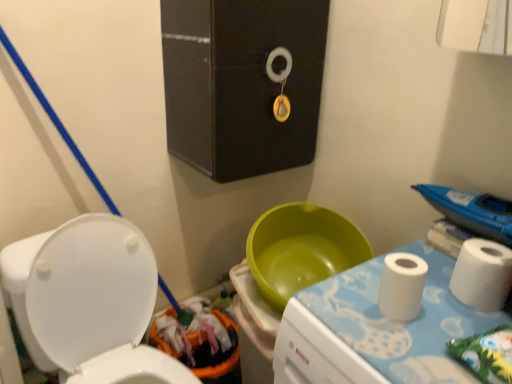
Identify the location of orange fabric potty at lower left. The height and width of the screenshot is (384, 512). (200, 342).

What is the approximate height of white matte toilet paper at right?

white matte toilet paper at right is 10.34 centimeters tall.

Describe the element at coordinates (472, 211) in the screenshot. I see `white paper towel at right` at that location.

I want to click on orange fabric potty at lower left, so click(x=200, y=342).

Which is less distant, (494, 287) or (493, 225)?

Point (494, 287) appears to be closer to the viewer than point (493, 225).

Is white matte toilet paper at right wider than white paper towel at right?

No, white matte toilet paper at right is not wider than white paper towel at right.

From a real-world perspective, which is physically below, white matte toilet paper at right or white paper towel at right?

white matte toilet paper at right.

In the image, is white matte toilet paper at right positioned in front of or behind white paper towel at right?

white matte toilet paper at right is in front of white paper towel at right.

Is white paper towel at right in front of or behind white matte toilet paper at right in the image?

Visually, white paper towel at right is located behind white matte toilet paper at right.

Identify the location of toilet paper beneath the white paper towel at right (from a real-world perspective). (402, 286).

Between white paper towel at right and white matte toilet paper at right, which one has smaller width?

With smaller width is white matte toilet paper at right.

Does point (461, 200) lie in front of point (420, 281)?

No, (461, 200) is further to viewer.

Considering the relative sizes of white glossy toilet at lower left and white matte toilet paper at right in the image provided, is white glossy toilet at lower left smaller than white matte toilet paper at right?

Actually, white glossy toilet at lower left might be larger than white matte toilet paper at right.

Image resolution: width=512 pixels, height=384 pixels. I want to click on toiletry on the right of white glossy toilet at lower left, so click(x=482, y=275).

In terms of width, does white glossy toilet at lower left look wider or thinner when compared to white matte toilet paper at right?

white glossy toilet at lower left is wider than white matte toilet paper at right.

Is white glossy toilet at lower left turned away from orange fabric potty at lower left?

No, orange fabric potty at lower left is not at the back of white glossy toilet at lower left.

From a real-world perspective, is white glossy toilet at lower left over orange fabric potty at lower left?

Correct, in the physical world, white glossy toilet at lower left is higher than orange fabric potty at lower left.

Is white glossy toilet at lower left positioned behind orange fabric potty at lower left?

No, it is in front of orange fabric potty at lower left.

Is white glossy toilet at lower left thinner than orange fabric potty at lower left?

No, white glossy toilet at lower left is not thinner than orange fabric potty at lower left.

In terms of size, does white matte toilet paper at right appear bigger or smaller than orange fabric potty at lower left?

Considering their sizes, white matte toilet paper at right takes up less space than orange fabric potty at lower left.

From a real-world perspective, who is located lower, white matte toilet paper at right or orange fabric potty at lower left?

orange fabric potty at lower left, from a real-world perspective.

Between white matte toilet paper at right and orange fabric potty at lower left, which one appears on the right side from the viewer's perspective?

white matte toilet paper at right.

Is orange fabric potty at lower left inside white matte toilet paper at right?

Actually, orange fabric potty at lower left is outside white matte toilet paper at right.

Could you tell me if white fabric changing table at right is turned towards white glossy toilet at lower left?

No, white fabric changing table at right is not facing towards white glossy toilet at lower left.

Who is shorter, white fabric changing table at right or white glossy toilet at lower left?

Standing shorter between the two is white fabric changing table at right.

From a real-world perspective, which is physically below, white fabric changing table at right or white glossy toilet at lower left?

In real-world perspective, white glossy toilet at lower left is lower.

Find the location of a particular element. toilet located underneath the white fabric changing table at right (from a real-world perspective) is located at coordinates (92, 300).

From the image's perspective, is white fabric changing table at right above or below orange fabric potty at lower left?

Clearly, from the image's perspective, white fabric changing table at right is above orange fabric potty at lower left.

Would you consider white fabric changing table at right to be distant from orange fabric potty at lower left?

No, white fabric changing table at right is in close proximity to orange fabric potty at lower left.

Is white fabric changing table at right wider or thinner than orange fabric potty at lower left?

Considering their sizes, white fabric changing table at right looks broader than orange fabric potty at lower left.

Looking at this image, do you think white fabric changing table at right is within orange fabric potty at lower left, or outside of it?

white fabric changing table at right is located beyond the bounds of orange fabric potty at lower left.

You are a GUI agent. You are given a task and a screenshot of the screen. Output one action in this format:
    pyautogui.click(x=<x>, y=<y>)
    Task: Click on the appliance on the right of white matte toilet paper at right
    The width and height of the screenshot is (512, 384).
    Given the screenshot: What is the action you would take?
    pyautogui.click(x=472, y=211)

The height and width of the screenshot is (384, 512). I want to click on toilet paper lying on the left of white paper towel at right, so click(402, 286).

From the image, which object appears to be farther from orange fabric potty at lower left, white matte toilet paper at right or white fabric changing table at right?

white matte toilet paper at right is positioned further to the anchor orange fabric potty at lower left.

Considering their positions, is white matte toilet paper at right positioned closer to white glossy toilet at lower left than white matte toilet paper at right?

white matte toilet paper at right is closer to white glossy toilet at lower left.

From the image, which object appears to be farther from white matte toilet paper at right, white matte toilet paper at right or white fabric changing table at right?

The object further to white matte toilet paper at right is white matte toilet paper at right.

Looking at the image, which one is located further to black matte medicine cabinet at upper center, orange fabric potty at lower left or white fabric changing table at right?

The object further to black matte medicine cabinet at upper center is orange fabric potty at lower left.

Which object lies nearer to the anchor point white matte toilet paper at right, white matte toilet paper at right or orange fabric potty at lower left?

white matte toilet paper at right lies closer to white matte toilet paper at right than the other object.

Based on their spatial positions, is white matte toilet paper at right or white fabric changing table at right closer to orange fabric potty at lower left?

Based on the image, white fabric changing table at right appears to be nearer to orange fabric potty at lower left.

From the image, which object appears to be nearer to orange fabric potty at lower left, white matte toilet paper at right or white paper towel at right?

The object closer to orange fabric potty at lower left is white matte toilet paper at right.

When comparing their distances from white matte toilet paper at right, does white paper towel at right or white glossy toilet at lower left seem closer?

The object closer to white matte toilet paper at right is white paper towel at right.

This screenshot has height=384, width=512. I want to click on potty between white glossy toilet at lower left and white matte toilet paper at right in the horizontal direction, so click(x=200, y=342).

I want to click on toilet between white fabric changing table at right and orange fabric potty at lower left from front to back, so click(92, 300).

Identify the location of toilet paper between white paper towel at right and white fabric changing table at right vertically. (402, 286).

Where is `toilet paper situated between white glossy toilet at lower left and white matte toilet paper at right from left to right`? Image resolution: width=512 pixels, height=384 pixels. toilet paper situated between white glossy toilet at lower left and white matte toilet paper at right from left to right is located at coordinates (402, 286).